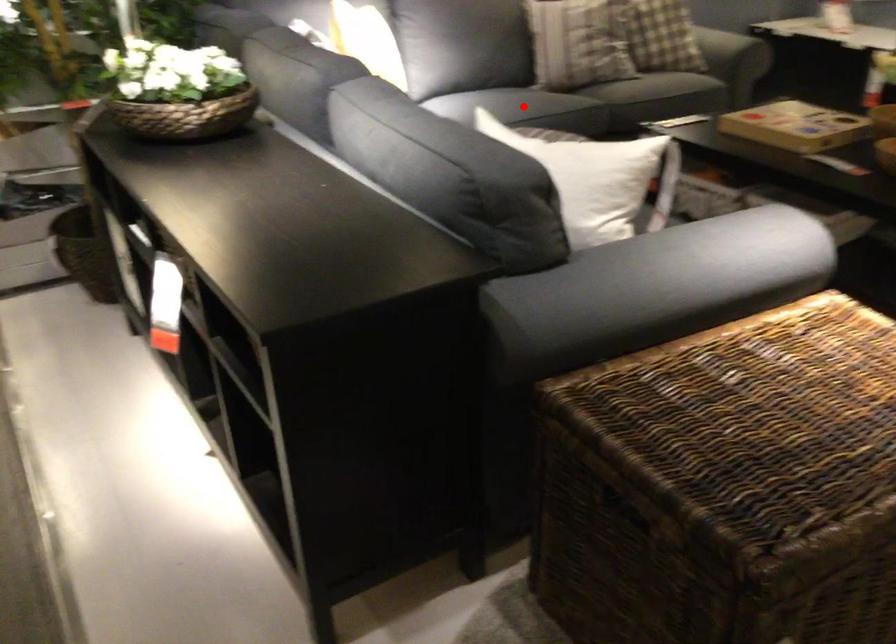
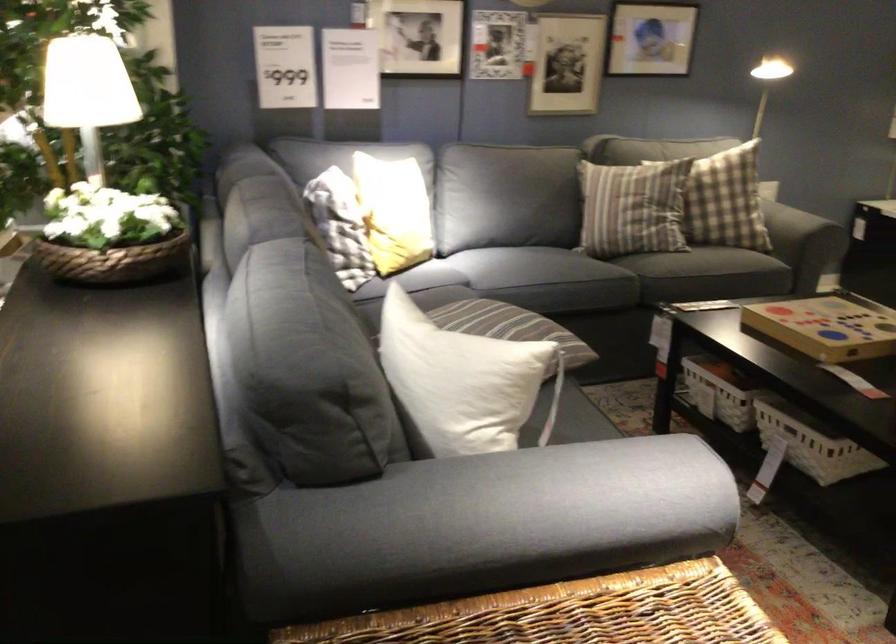
In the second image, find the point that corresponds to the highlighted location in the first image.

(538, 267)